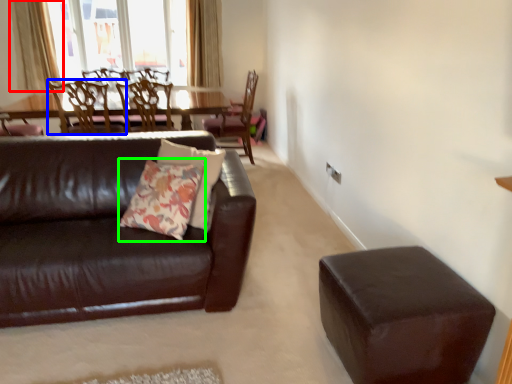
Question: Estimate the real-world distances between objects in this image. Which object is farther from curtain (highlighted by a red box), chair (highlighted by a blue box) or throw pillow (highlighted by a green box)?

Choices:
 (A) chair
 (B) throw pillow

Answer: (B)